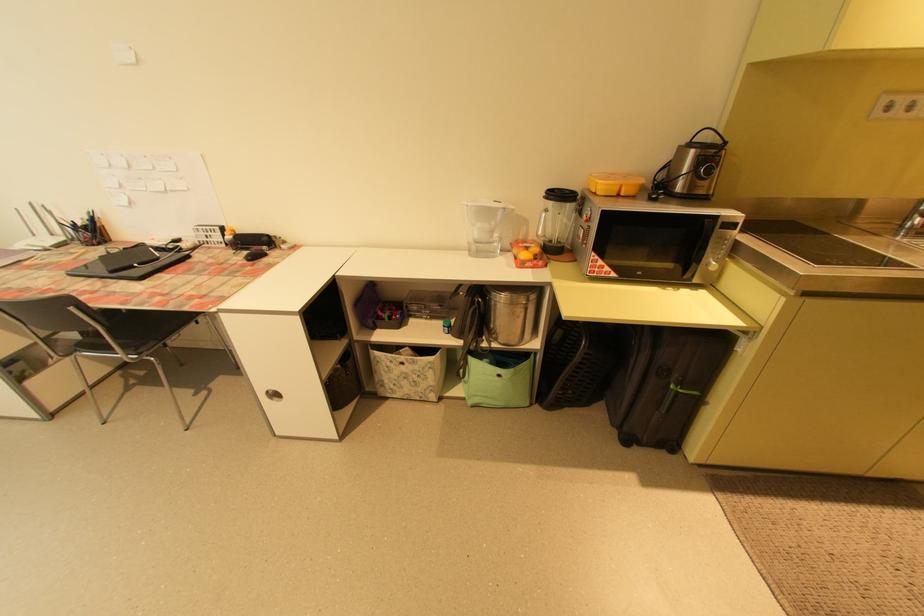
Where would you lift the green fabric basket? Please return your answer as a coordinate pair (x, y).

(499, 379)